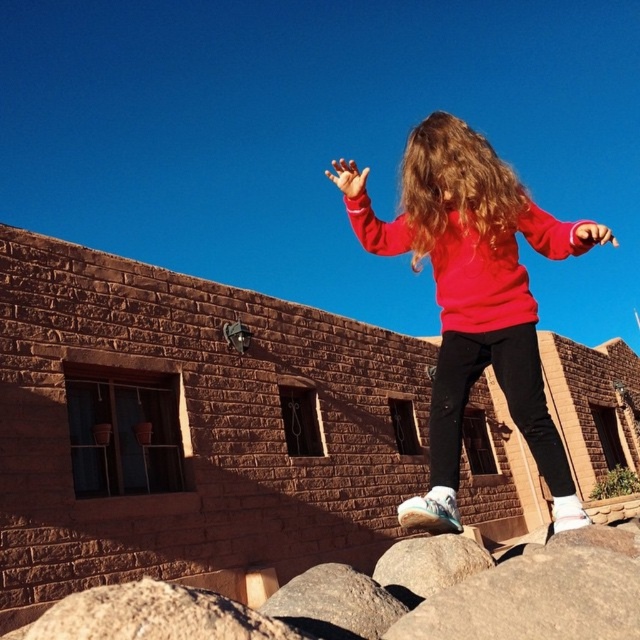
You are a painter observing the scene and want to paint the hands in the image. Which hand, the smooth orange hand at upper center or the matte pink hand at upper right, is closer to the ground?

The smooth orange hand at upper center is shorter than the matte pink hand at upper right, so the smooth orange hand at upper center is closer to the ground.